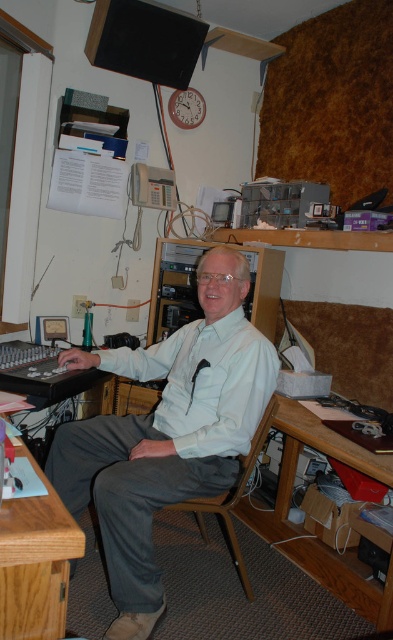
You are a visitor in the room and want to place a small notebook on the brown wood table at lower left. To reach the table, you need to walk around the white matte shirt at center. Is the table in front of or behind the shirt?

The brown wood table at lower left is behind the white matte shirt at center, so the table is behind the shirt.

You are a delivery person who needs to place a small package between the wooden at lower right and the wooden chair at center. Can you fit the package there?

The distance between the wooden at lower right and the wooden chair at center is 33.17 centimeters, so the package can be placed there as long as it is smaller than that width.

You are standing in the room and want to pick up the wooden at lower right and the wooden chair at center. Which object is easier to reach without moving your current position?

The wooden at lower right is closer to the viewer, so it is easier to reach without moving your current position.